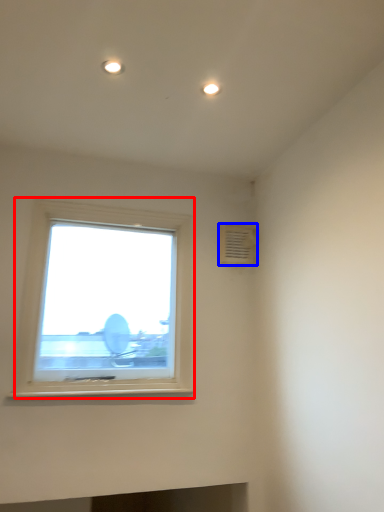
Question: Which object appears closest to the camera in this image, window (highlighted by a red box) or air conditioning (highlighted by a blue box)?

Choices:
 (A) window
 (B) air conditioning

Answer: (A)